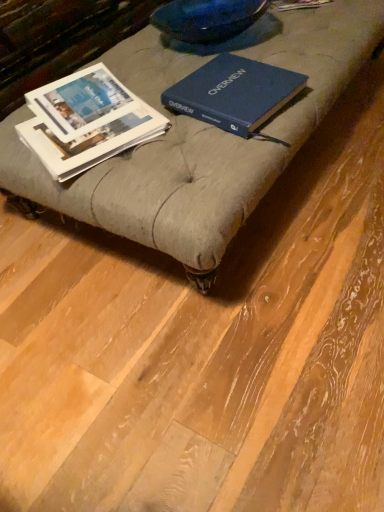
The height and width of the screenshot is (512, 384). What do you see at coordinates (234, 93) in the screenshot? I see `blue hardcover book at center, marked as the 1th book in a right-to-left arrangement` at bounding box center [234, 93].

Image resolution: width=384 pixels, height=512 pixels. In order to click on matte gray ottoman at center in this screenshot , I will do `click(203, 137)`.

Is point (86, 94) more distant than point (158, 31)?

No, (86, 94) is in front of (158, 31).

Is white paper book at left, the 2th book viewed from the right, wider than matte gray ottoman at center?

No, white paper book at left, the 2th book viewed from the right, is not wider than matte gray ottoman at center.

How much distance is there between white paper book at left, the 2th book viewed from the right, and matte gray ottoman at center?

The distance of white paper book at left, the 2th book viewed from the right, from matte gray ottoman at center is 7.73 inches.

Is blue hardcover book at center, marked as the 1th book in a right-to-left arrangement, looking in the opposite direction of white paper book at left, which appears as the 1th book when viewed from the left?

Yes.

Could you measure the distance between blue hardcover book at center, the second book when ordered from left to right, and white paper book at left, which appears as the 1th book when viewed from the left?

8.59 inches.

The width and height of the screenshot is (384, 512). I want to click on book lying behind the white paper book at left, the 2th book viewed from the right, so click(234, 93).

Is blue hardcover book at center, the second book when ordered from left to right, directly adjacent to white paper book at left, the 2th book viewed from the right?

No, blue hardcover book at center, the second book when ordered from left to right, is not next to white paper book at left, the 2th book viewed from the right.

Is matte gray ottoman at center inside the boundaries of blue hardcover book at center, marked as the 1th book in a right-to-left arrangement, or outside?

The correct answer is: outside.

Between matte gray ottoman at center and blue hardcover book at center, the second book when ordered from left to right, which one has larger width?

With larger width is matte gray ottoman at center.

Considering the relative positions of matte gray ottoman at center and blue hardcover book at center, marked as the 1th book in a right-to-left arrangement, in the image provided, is matte gray ottoman at center to the left of blue hardcover book at center, marked as the 1th book in a right-to-left arrangement, from the viewer's perspective?

Yes.

Does matte gray ottoman at center turn towards blue hardcover book at center, the second book when ordered from left to right?

No, matte gray ottoman at center is not turned towards blue hardcover book at center, the second book when ordered from left to right.

From a real-world perspective, which is physically above, blue hardcover book at center, the second book when ordered from left to right, or matte gray ottoman at center?

blue hardcover book at center, the second book when ordered from left to right, is physically above.

Image resolution: width=384 pixels, height=512 pixels. I want to click on the 2nd book located above the matte gray ottoman at center (from a real-world perspective), so click(x=234, y=93).

Is blue hardcover book at center, marked as the 1th book in a right-to-left arrangement, wider than matte gray ottoman at center?

No.

Relative to matte gray ottoman at center, is blue hardcover book at center, marked as the 1th book in a right-to-left arrangement, in front or behind?

In the image, blue hardcover book at center, marked as the 1th book in a right-to-left arrangement, appears behind matte gray ottoman at center.

From the image's perspective, between white paper book at left, the 2th book viewed from the right, and blue hardcover book at center, marked as the 1th book in a right-to-left arrangement, who is located below?

white paper book at left, the 2th book viewed from the right, is shown below in the image.

Measure the distance between white paper book at left, which appears as the 1th book when viewed from the left, and blue hardcover book at center, marked as the 1th book in a right-to-left arrangement.

A distance of 8.59 inches exists between white paper book at left, which appears as the 1th book when viewed from the left, and blue hardcover book at center, marked as the 1th book in a right-to-left arrangement.

Can you tell me how much white paper book at left, which appears as the 1th book when viewed from the left, and blue hardcover book at center, the second book when ordered from left to right, differ in facing direction?

12.9 degrees separate the facing orientations of white paper book at left, which appears as the 1th book when viewed from the left, and blue hardcover book at center, the second book when ordered from left to right.

Is white paper book at left, the 2th book viewed from the right, positioned beyond the bounds of blue hardcover book at center, marked as the 1th book in a right-to-left arrangement?

white paper book at left, the 2th book viewed from the right, is positioned outside blue hardcover book at center, marked as the 1th book in a right-to-left arrangement.

Measure the distance between matte gray ottoman at center and white paper book at left, the 2th book viewed from the right.

They are 7.73 inches apart.

Who is smaller, matte gray ottoman at center or white paper book at left, the 2th book viewed from the right?

white paper book at left, the 2th book viewed from the right, is smaller.

Considering the relative sizes of matte gray ottoman at center and white paper book at left, the 2th book viewed from the right, in the image provided, is matte gray ottoman at center shorter than white paper book at left, the 2th book viewed from the right,?

Indeed, matte gray ottoman at center has a lesser height compared to white paper book at left, the 2th book viewed from the right.

Considering the positions of objects matte gray ottoman at center and white paper book at left, the 2th book viewed from the right, in the image provided, who is more to the left, matte gray ottoman at center or white paper book at left, the 2th book viewed from the right,?

white paper book at left, the 2th book viewed from the right.

Find the location of a particular element. furniture below the white paper book at left, the 2th book viewed from the right (from a real-world perspective) is located at coordinates (203, 137).

Where is `book above the white paper book at left, which appears as the 1th book when viewed from the left (from the image's perspective)`? This screenshot has height=512, width=384. book above the white paper book at left, which appears as the 1th book when viewed from the left (from the image's perspective) is located at coordinates point(234,93).

When comparing their distances from matte gray ottoman at center, does white paper book at left, the 2th book viewed from the right, or blue hardcover book at center, marked as the 1th book in a right-to-left arrangement, seem closer?

blue hardcover book at center, marked as the 1th book in a right-to-left arrangement, is closer to matte gray ottoman at center.

From the picture: When comparing their distances from blue hardcover book at center, marked as the 1th book in a right-to-left arrangement, does white paper book at left, which appears as the 1th book when viewed from the left, or matte gray ottoman at center seem closer?

matte gray ottoman at center.

Considering their positions, is blue hardcover book at center, the second book when ordered from left to right, positioned closer to white paper book at left, the 2th book viewed from the right, than matte gray ottoman at center?

matte gray ottoman at center.

Looking at the image, which one is located closer to white paper book at left, the 2th book viewed from the right, matte gray ottoman at center or blue hardcover book at center, marked as the 1th book in a right-to-left arrangement?

matte gray ottoman at center is positioned closer to the anchor white paper book at left, the 2th book viewed from the right.

Looking at the image, which one is located closer to matte gray ottoman at center, blue hardcover book at center, the second book when ordered from left to right, or white paper book at left, the 2th book viewed from the right?

blue hardcover book at center, the second book when ordered from left to right, lies closer to matte gray ottoman at center than the other object.

Looking at this image, based on their spatial positions, is matte gray ottoman at center or white paper book at left, which appears as the 1th book when viewed from the left, closer to blue hardcover book at center, marked as the 1th book in a right-to-left arrangement?

The object closer to blue hardcover book at center, marked as the 1th book in a right-to-left arrangement, is matte gray ottoman at center.

Locate an element on the screen. The width and height of the screenshot is (384, 512). book located between matte gray ottoman at center and blue hardcover book at center, marked as the 1th book in a right-to-left arrangement, in the depth direction is located at coordinates (86, 122).